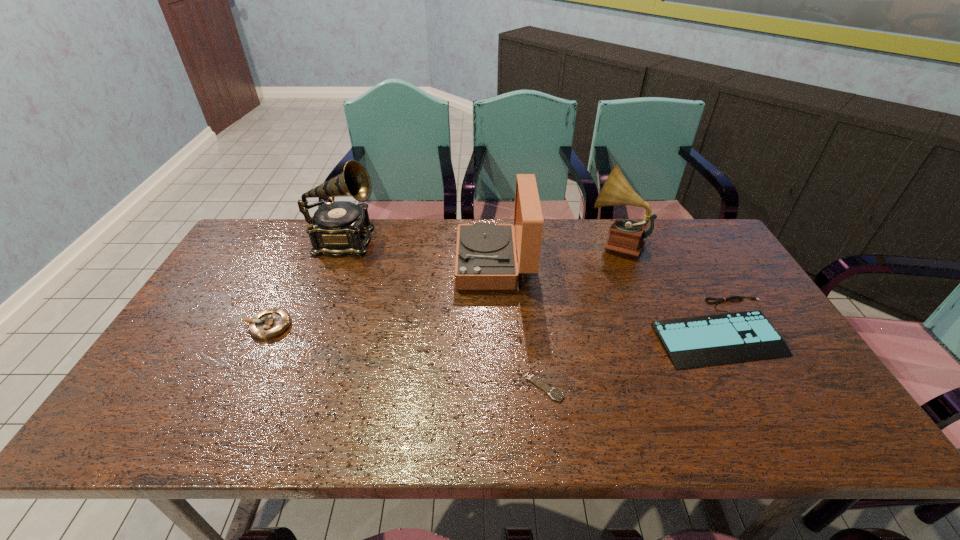
This screenshot has height=540, width=960. In order to click on object that is the fourth closest to the leftmost phonograph record in this screenshot , I will do `click(626, 236)`.

Identify which object is located as the third nearest to the fifth tallest object. Please provide its 2D coordinates. Your answer should be formatted as a tuple, i.e. [(x, y)], where the tuple contains the x and y coordinates of a point satisfying the conditions above.

[(486, 259)]

Find the location of a particular element. The image size is (960, 540). phonograph record that stands as the second closest to the leftmost phonograph record is located at coordinates (626, 236).

The width and height of the screenshot is (960, 540). Identify the location of the closest phonograph record to the second phonograph record from right to left. (626, 236).

Where is `vacant point that satisfies the following two spatial constraints: 1. on the face of the second phonograph record from right to left; 2. on the back side of the computer keyboard`? This screenshot has width=960, height=540. vacant point that satisfies the following two spatial constraints: 1. on the face of the second phonograph record from right to left; 2. on the back side of the computer keyboard is located at coordinates (497, 330).

Where is `vacant space that satisfies the following two spatial constraints: 1. on the horn of the leftmost phonograph record; 2. on the right side of the watch`? The image size is (960, 540). vacant space that satisfies the following two spatial constraints: 1. on the horn of the leftmost phonograph record; 2. on the right side of the watch is located at coordinates (289, 387).

Find the location of a particular element. The height and width of the screenshot is (540, 960). free location that satisfies the following two spatial constraints: 1. on the back side of the nearest object; 2. on the face of the second phonograph record from right to left is located at coordinates (528, 264).

Where is `vacant space that satisfies the following two spatial constraints: 1. on the horn of the leftmost phonograph record; 2. on the back side of the fifth tallest object`? The width and height of the screenshot is (960, 540). vacant space that satisfies the following two spatial constraints: 1. on the horn of the leftmost phonograph record; 2. on the back side of the fifth tallest object is located at coordinates (311, 330).